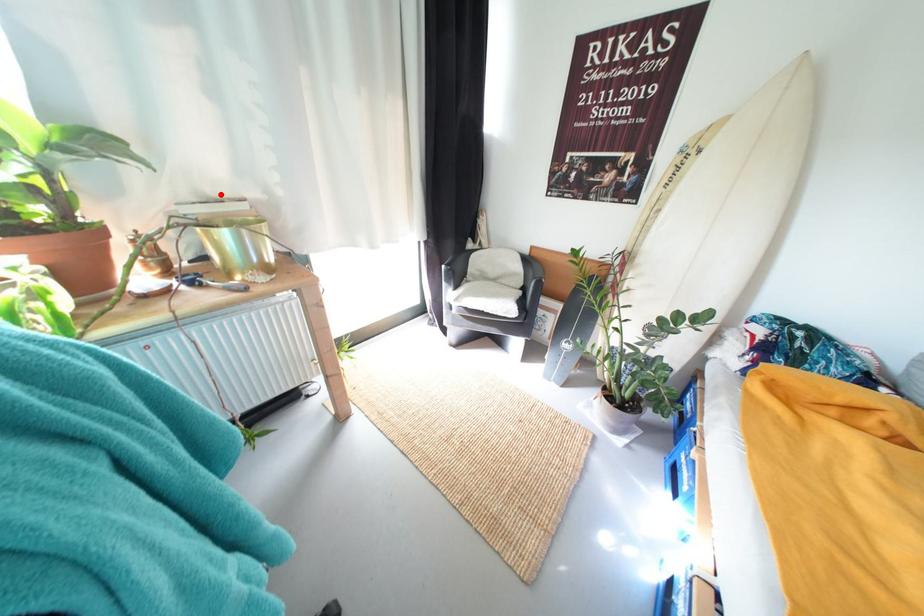
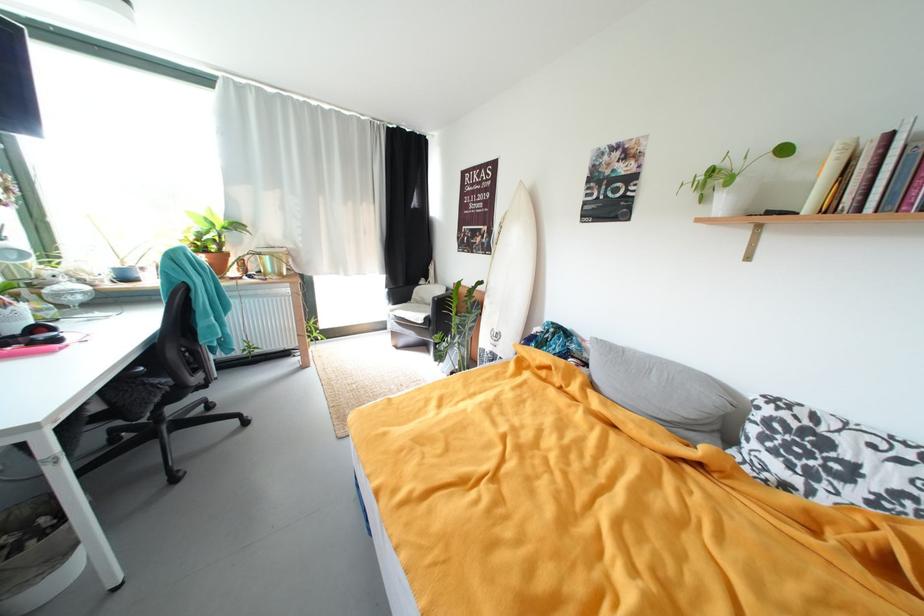
The point at the highlighted location is marked in the first image. Where is the corresponding point in the second image?

(281, 246)